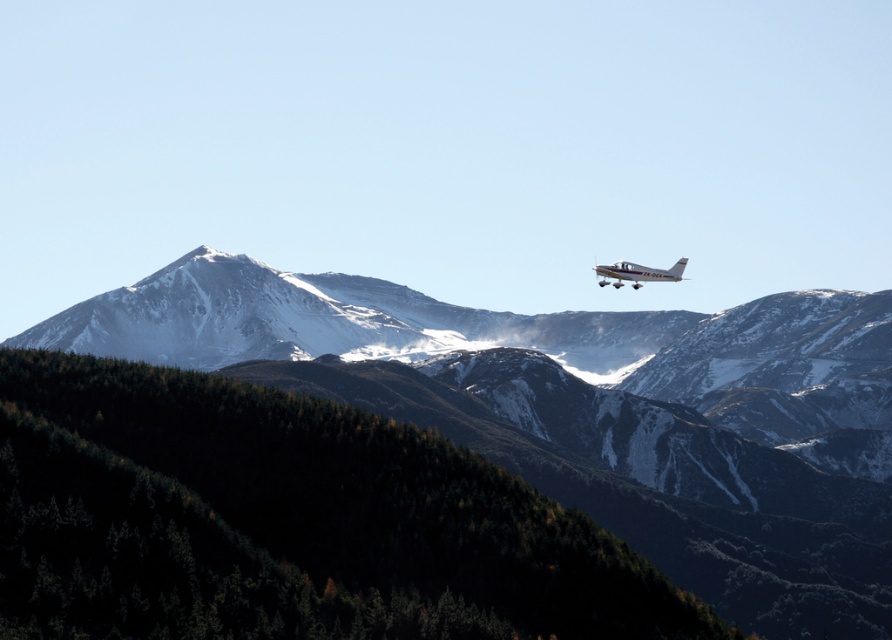
You are a pilot flying the silver metallic airplane at upper right and want to navigate around the snowy rocky mountain range at upper center. In which direction should you turn to avoid the mountains?

You should turn to the right to avoid the snowy rocky mountain range at upper center, as it is located to the left of the silver metallic airplane at upper right.

You are a pilot flying the silver metallic airplane at upper right. You need to navigate around the snowy rocky mountain range at upper center. Based on the scene, which direction should you turn to avoid the mountains?

The snowy rocky mountain range at upper center is larger in size than the silver metallic airplane at upper right, so you should turn right to avoid the mountains.

You are a drone operator trying to navigate your drone through the mountainous landscape shown in the image. You need to fly from the dense forested area in the foreground to the small aircraft in the background. There is a point marked at coordinates point (587, 412). What is the purpose of this point in your flight path?

The point (587, 412) marks the snowy rocky mountain range at upper center, which is an obstacle that the drone must avoid while navigating from the dense forested area to the small aircraft in the background.